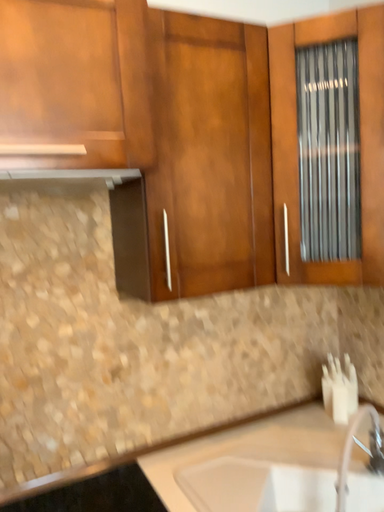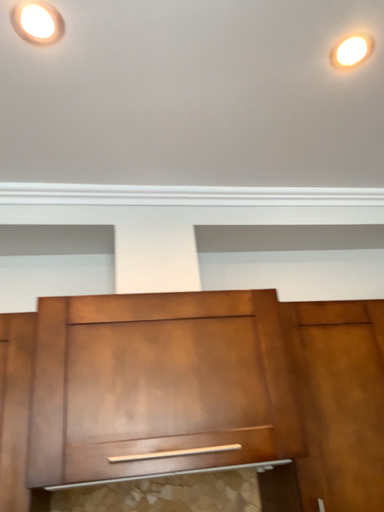
Question: Which way did the camera rotate in the video?

Choices:
 (A) rotated right
 (B) rotated left

Answer: (B)